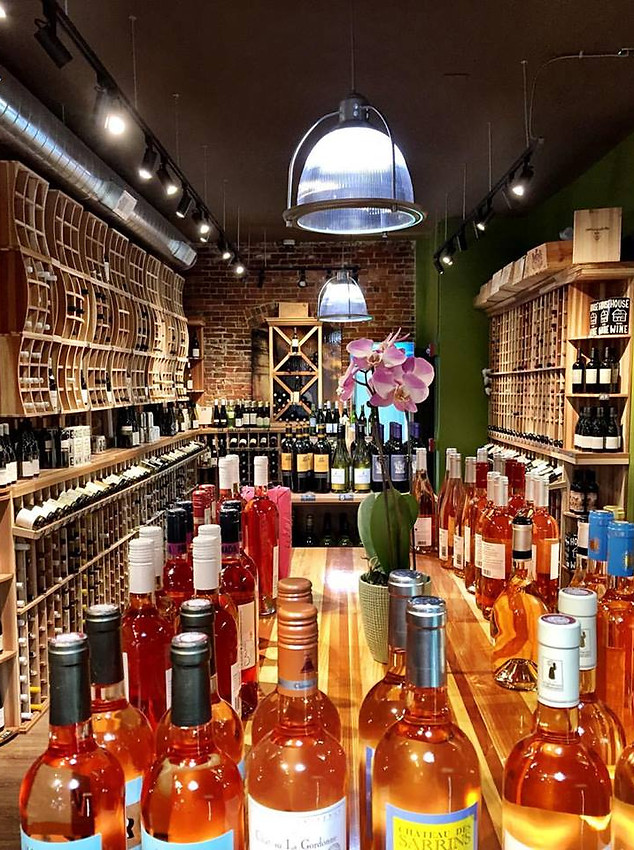
I want to click on wooden floor, so click(x=311, y=564), click(x=339, y=567), click(x=357, y=564), click(x=458, y=615), click(x=469, y=690), click(x=340, y=673), click(x=20, y=754), click(x=342, y=650), click(x=269, y=653).